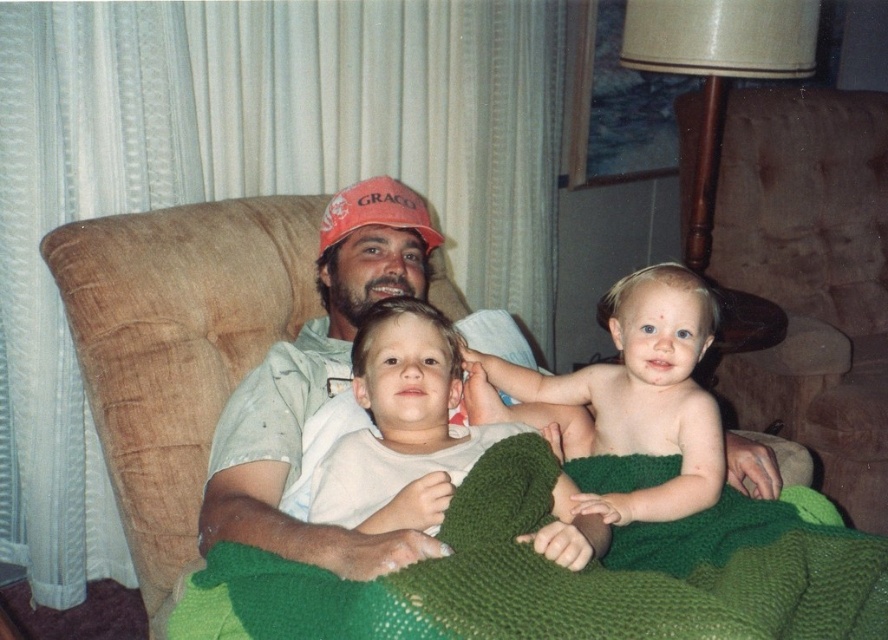
Looking at the scene, the smooth skin baby at center and the orange fabric baseball cap at center are both in the image. Which one is positioned to the right?

The smooth skin baby at center is to the right of the orange fabric baseball cap at center.

You are a photographer trying to capture a photo of the brown fabric couch at center and the smooth skin baby at center. Based on their positions, which object is closer to the camera?

The brown fabric couch at center is above the smooth skin baby at center, meaning the baby is closer to the camera.

Consider the image. You are standing 2 meters away from the image. You want to reach the point at coordinates point (302, 225). Can you reach it without moving closer?

The distance of point (302, 225) is 1.75 meters from the viewer. Since you are currently 2 meters away, you are farther than the point, so you need to move closer to reach it.